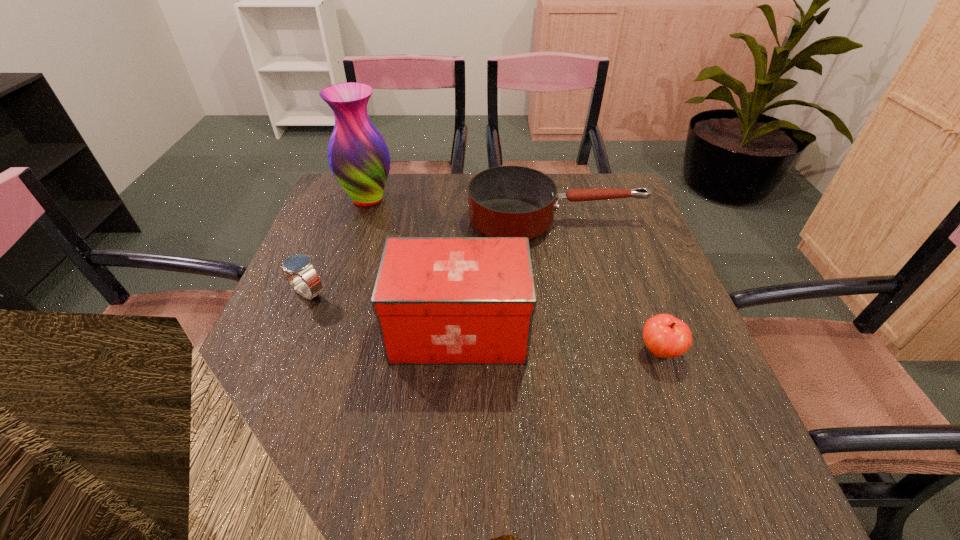
Locate an element on the screen. This screenshot has height=540, width=960. vacant space at the far left corner of the desktop is located at coordinates (329, 205).

This screenshot has height=540, width=960. In the image, there is a desktop. Identify the location of vacant space at the near left corner. (277, 490).

Locate an element on the screen. free location at the near right corner is located at coordinates (775, 502).

In order to click on free space between the apple and the pan in this screenshot , I will do `click(608, 285)`.

The image size is (960, 540). I want to click on vacant area that lies between the tallest object and the watch, so click(338, 246).

At what (x,y) coordinates should I click in order to perform the action: click on vacant region between the apple and the first-aid kit. Please return your answer as a coordinate pair (x, y). Image resolution: width=960 pixels, height=540 pixels. Looking at the image, I should click on (560, 341).

Where is `unoccupied area between the pan and the vase`? This screenshot has width=960, height=540. unoccupied area between the pan and the vase is located at coordinates (462, 209).

Locate an element on the screen. This screenshot has width=960, height=540. the second closest object relative to the pan is located at coordinates (359, 158).

Choose which object is the nearest neighbor to the pan. Please provide its 2D coordinates. Your answer should be formatted as a tuple, i.e. [(x, y)], where the tuple contains the x and y coordinates of a point satisfying the conditions above.

[(438, 300)]

The height and width of the screenshot is (540, 960). In order to click on free space that satisfies the following two spatial constraints: 1. on the handle side of the fourth shortest object; 2. on the right side of the apple in this screenshot , I will do `click(458, 352)`.